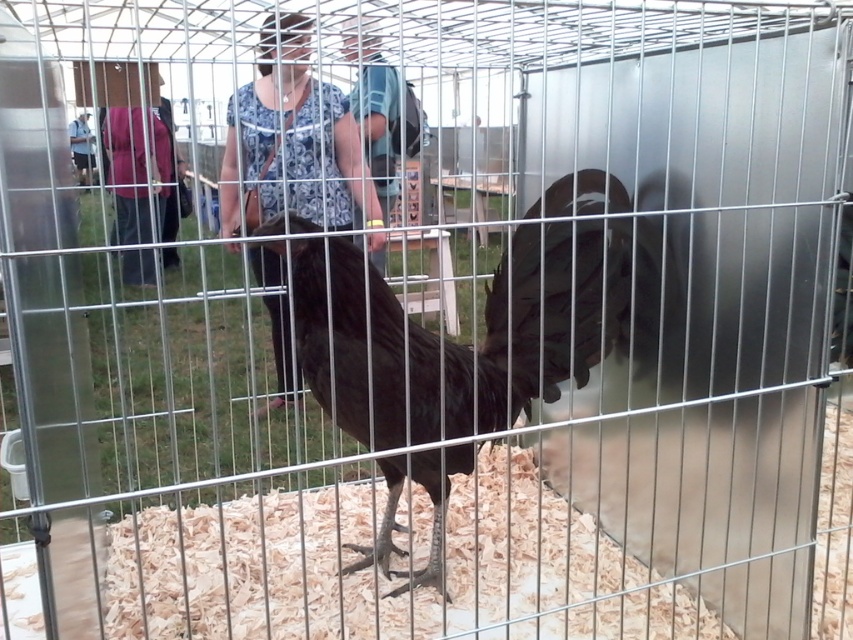
You are standing in front of the cage with the rooster at the agricultural fair. You notice a person wearing a blue floral shirt at center. Can you determine if this person is closer to the cage or further away from it compared to the rooster?

The blue floral shirt at center is located at point (292, 141), which indicates its position relative to the cage. Since the coordinates are provided without depth information, it is not possible to determine if the person is closer to or further away from the cage compared to the rooster based solely on the given data.